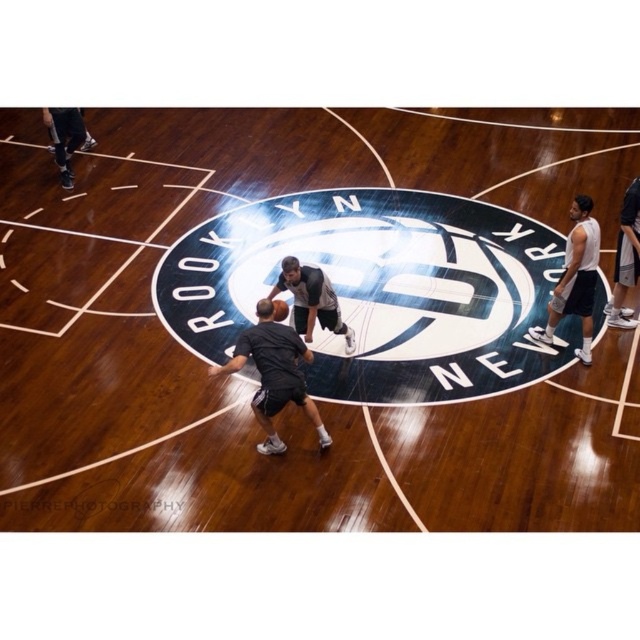
You are a photographer setting up a shot of the wooden basketball court at center and the white matte tank top at right. Which object should you focus on first if you want to capture both in a single frame without moving the camera?

The wooden basketball court at center is bigger than the white matte tank top at right, so you should focus on the wooden basketball court at center first to ensure it fills the frame appropriately before adjusting for the smaller object.

You are a basketball player standing at the edge of the court. You see the dark gray shorts at center and the shiny orange basketball at center. Which object is closer to the center of the court?

Both the dark gray shorts at center and the shiny orange basketball at center are positioned at the center of the court, so they are equally close to the center.